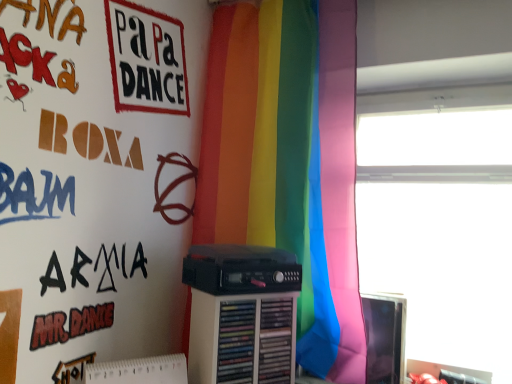
Question: Does matte black monitor at right have a smaller size compared to transparent glass window at upper right?

Choices:
 (A) yes
 (B) no

Answer: (A)

Question: Does matte black monitor at right have a lesser width compared to transparent glass window at upper right?

Choices:
 (A) yes
 (B) no

Answer: (A)

Question: Considering the relative sizes of matte black monitor at right and transparent glass window at upper right in the image provided, is matte black monitor at right wider than transparent glass window at upper right?

Choices:
 (A) no
 (B) yes

Answer: (A)

Question: From the image's perspective, would you say matte black monitor at right is positioned over transparent glass window at upper right?

Choices:
 (A) no
 (B) yes

Answer: (A)

Question: Does matte black monitor at right come behind transparent glass window at upper right?

Choices:
 (A) no
 (B) yes

Answer: (B)

Question: From a real-world perspective, is matte black monitor at right above or below transparent glass window at upper right?

Choices:
 (A) above
 (B) below

Answer: (B)

Question: Does point (375, 309) appear closer or farther from the camera than point (390, 142)?

Choices:
 (A) closer
 (B) farther

Answer: (A)

Question: Visually, is matte black monitor at right positioned to the left or to the right of transparent glass window at upper right?

Choices:
 (A) left
 (B) right

Answer: (A)

Question: From the image's perspective, relative to transparent glass window at upper right, is matte black monitor at right above or below?

Choices:
 (A) below
 (B) above

Answer: (A)

Question: In terms of width, does transparent glass window at upper right look wider or thinner when compared to black plastic cassette at center?

Choices:
 (A) thin
 (B) wide

Answer: (B)

Question: Considering the positions of transparent glass window at upper right and black plastic cassette at center in the image, is transparent glass window at upper right taller or shorter than black plastic cassette at center?

Choices:
 (A) tall
 (B) short

Answer: (A)

Question: From the image's perspective, is transparent glass window at upper right positioned above or below black plastic cassette at center?

Choices:
 (A) below
 (B) above

Answer: (B)

Question: Do you think transparent glass window at upper right is within black plastic cassette at center, or outside of it?

Choices:
 (A) inside
 (B) outside

Answer: (B)

Question: Would you say rainbow fabric curtain at center is inside or outside black plastic cassette at center?

Choices:
 (A) inside
 (B) outside

Answer: (B)

Question: Considering the positions of rainbow fabric curtain at center and black plastic cassette at center in the image, is rainbow fabric curtain at center taller or shorter than black plastic cassette at center?

Choices:
 (A) short
 (B) tall

Answer: (B)